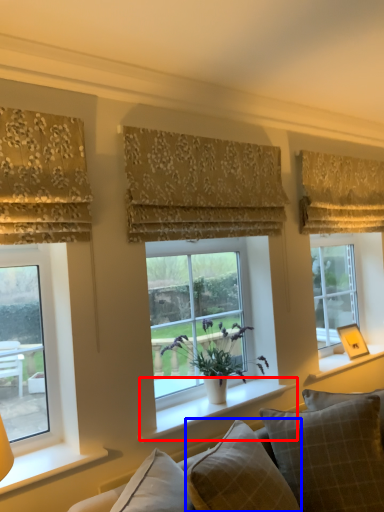
Question: Which of the following is the closest to the observer, window sill (highlighted by a red box) or pillow (highlighted by a blue box)?

Choices:
 (A) window sill
 (B) pillow

Answer: (B)